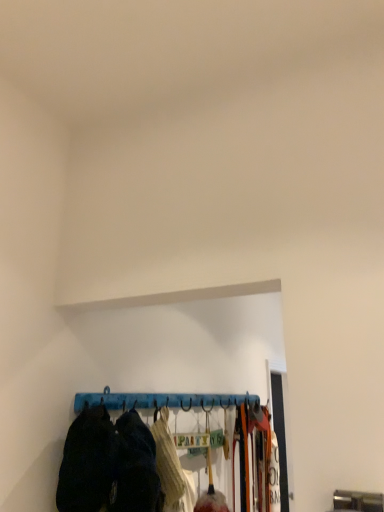
Question: Should I look upward or downward to see knitted wool sweater at center?

Choices:
 (A) down
 (B) up

Answer: (A)